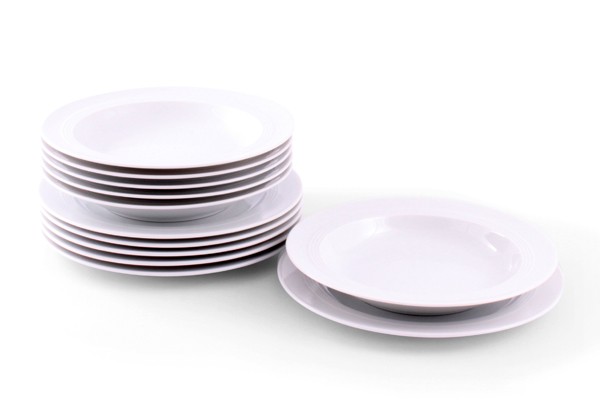
Identify the location of plates. This screenshot has width=600, height=400. (372, 328), (186, 275), (195, 264), (199, 254), (209, 244), (217, 234).